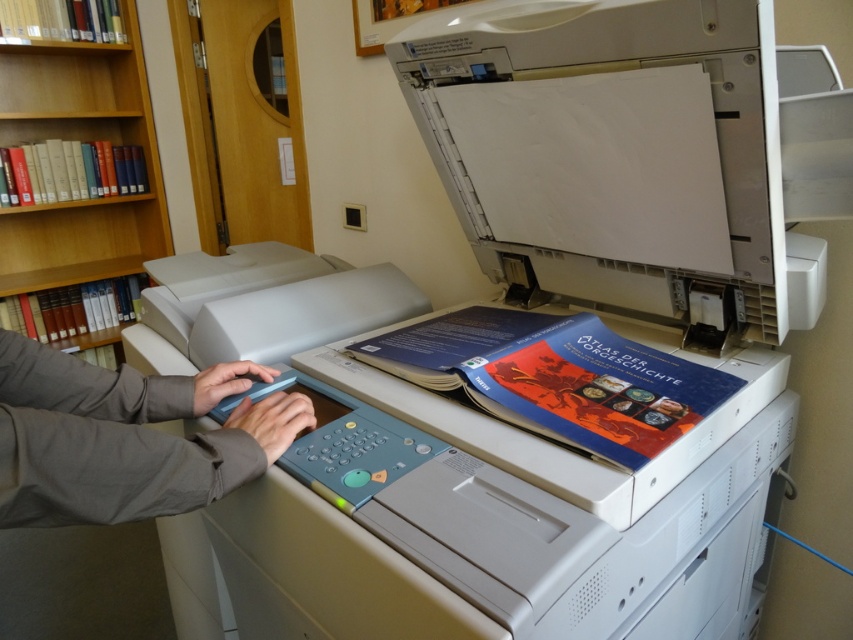
You are organizing a bookshelf and need to place the gray fabric hands at center and the wooden bookshelf at left. Which object requires more space horizontally?

The wooden bookshelf at left requires more horizontal space because it is wider than the gray fabric hands at center.

What is the 2D coordinate of the gray fabric hands at center?

The gray fabric hands at center are located at the 2D coordinate point of (126, 436).

You are organizing a space and need to know the dimensions of the wooden bookshelf at left and the white plastic printer at center. Based on the scene, which object is wider?

The wooden bookshelf at left is wider than the white plastic printer at center according to the description.